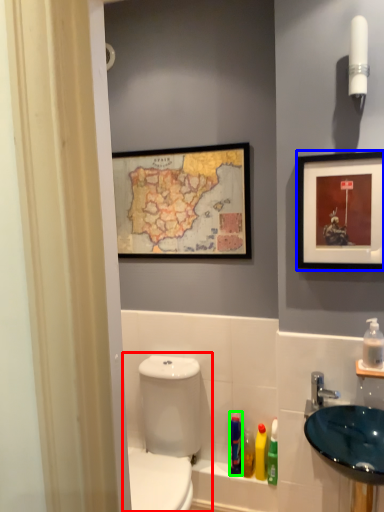
Question: Considering the real-world distances, which object is closest to toilet (highlighted by a red box)? picture frame (highlighted by a blue box) or mouthwash (highlighted by a green box).

Choices:
 (A) picture frame
 (B) mouthwash

Answer: (B)